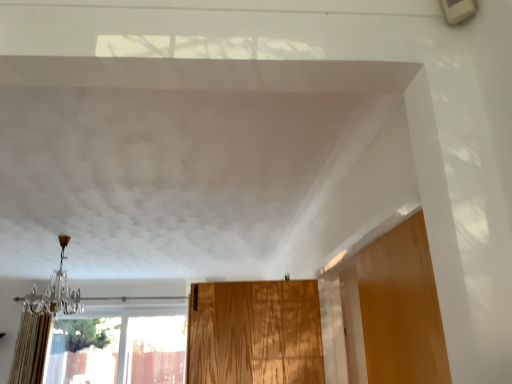
Question: Looking at the image, does beige textured curtain at left seem bigger or smaller compared to crystal glass chandelier at left?

Choices:
 (A) big
 (B) small

Answer: (A)

Question: Is beige textured curtain at left in front of or behind crystal glass chandelier at left in the image?

Choices:
 (A) behind
 (B) front

Answer: (A)

Question: Estimate the real-world distances between objects in this image. Which object is closer to the beige textured curtain at left?

Choices:
 (A) crystal glass chandelier at left
 (B) transparent glass window at lower left

Answer: (A)

Question: Considering the real-world distances, which object is farthest from the crystal glass chandelier at left?

Choices:
 (A) beige textured curtain at left
 (B) transparent glass window at lower left

Answer: (B)